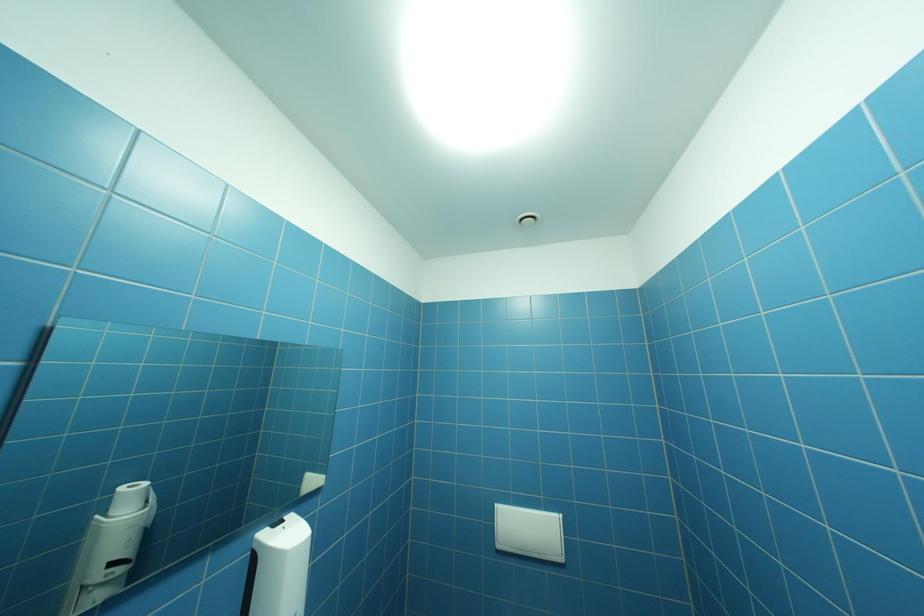
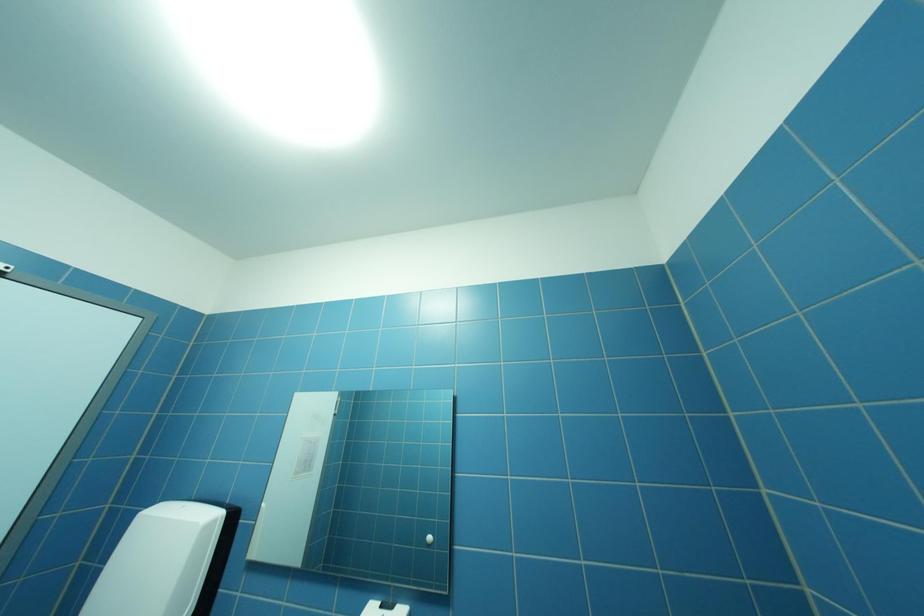
Based on the continuous images, in which direction is the camera rotating?

The rotation direction of the camera is left-up.